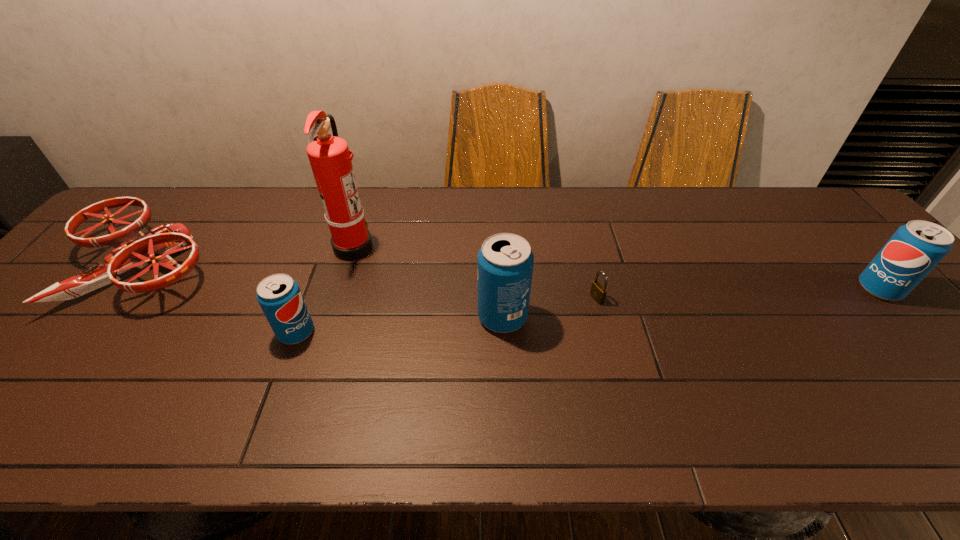
You are a GUI agent. You are given a task and a screenshot of the screen. Output one action in this format:
    pyautogui.click(x=<x>, y=<y>)
    Task: Click on the vacant space that satisfies the following two spatial constraints: 1. at the nozzle of the second object from right to left; 2. on the right side of the tallest object
    This screenshot has height=540, width=960.
    Given the screenshot: What is the action you would take?
    pyautogui.click(x=338, y=299)

Locate an element on the screen. free space in the image that satisfies the following two spatial constraints: 1. at the nozzle of the fire extinguisher; 2. on the right side of the second tallest soda can is located at coordinates (341, 289).